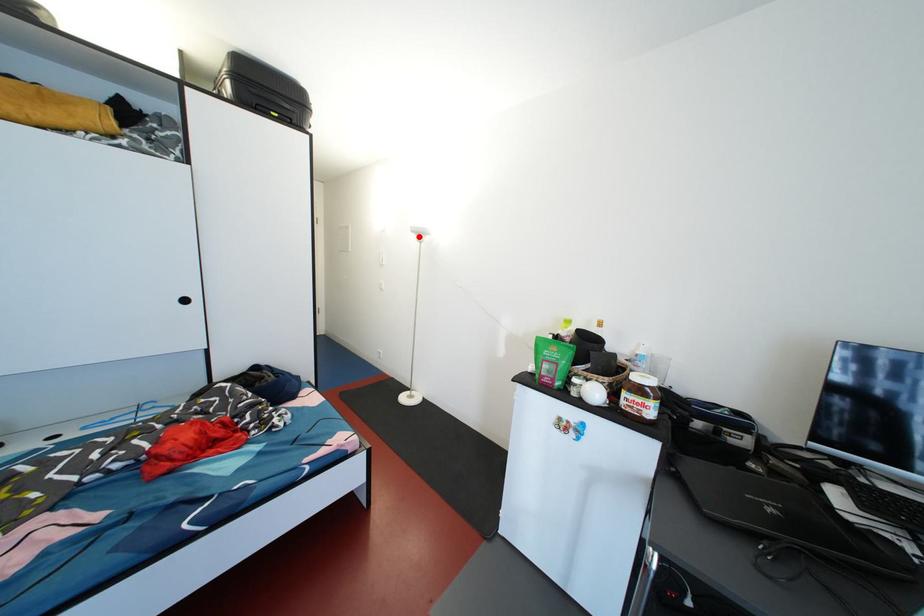
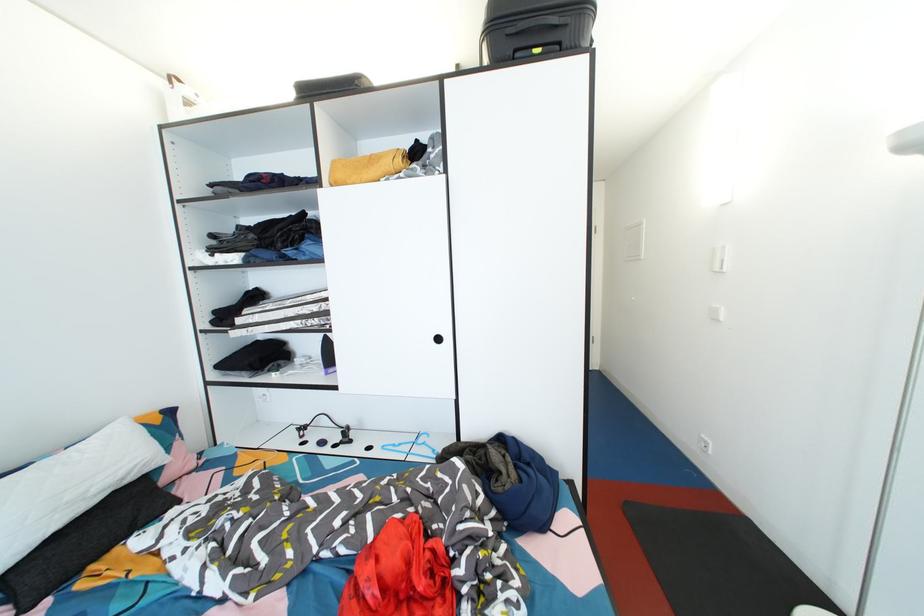
Find the pixel in the second image that matches the highlighted location in the first image.

(913, 152)